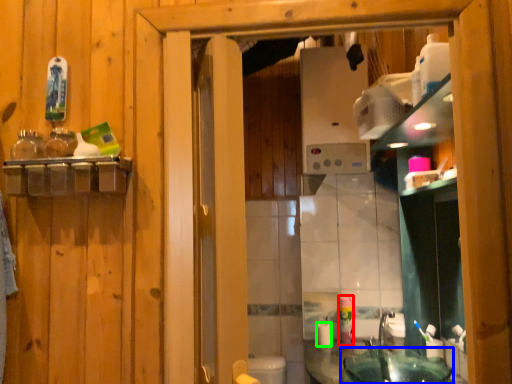
Question: Estimate the real-world distances between objects in this image. Which object is farther from mouthwash (highlighted by a red box), sink (highlighted by a blue box) or toilet paper (highlighted by a green box)?

Choices:
 (A) sink
 (B) toilet paper

Answer: (A)